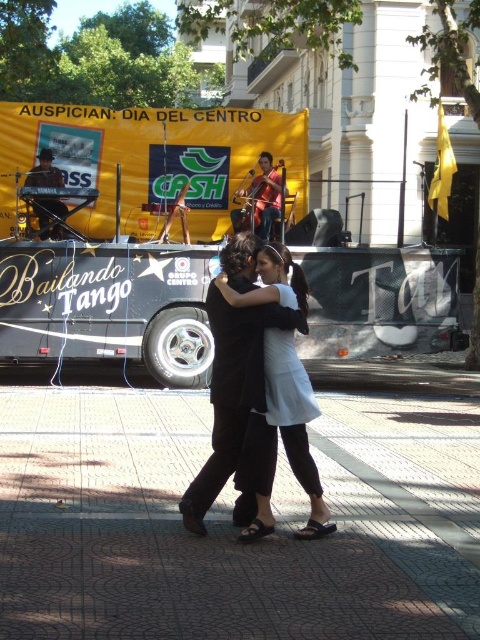
You are a photographer standing at the center of the street. You want to take a photo that includes both the couple dancing tango in the foreground and the stage backdrop with the sponsor logos in the background. Given that you have two points of interest marked as point 1 at coordinates point (271, 195) and point 2 at coordinates point (39, 196), which point should you focus on to ensure both the dancers and the stage are in focus?

Point 1 at coordinates point (271, 195) is behind point 2 at coordinates point (39, 196). To ensure both the dancers and the stage are in focus, you should focus on the point that is further away, which is point 1 at coordinates point (271, 195).

You are a photographer standing in the middle of the street. You want to take a photo of the orange fabric cello at center and the shiny black drum set at upper left. Which object should you focus on first if you want to include both in your frame without moving your camera?

The orange fabric cello at center is positioned over the shiny black drum set at upper left, so you should focus on the orange fabric cello at center first to ensure both are in the frame.